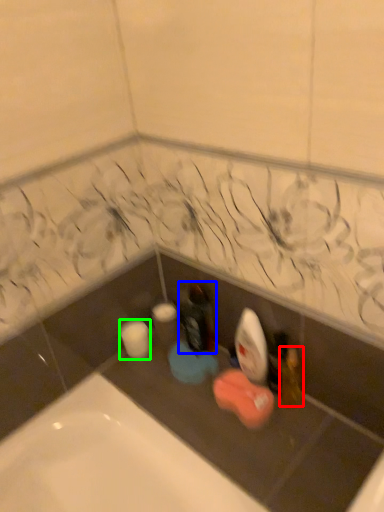
Question: Estimate the real-world distances between objects in this image. Which object is closer to toiletry (highlighted by a red box), bottle (highlighted by a blue box) or toilet paper (highlighted by a green box)?

Choices:
 (A) bottle
 (B) toilet paper

Answer: (A)